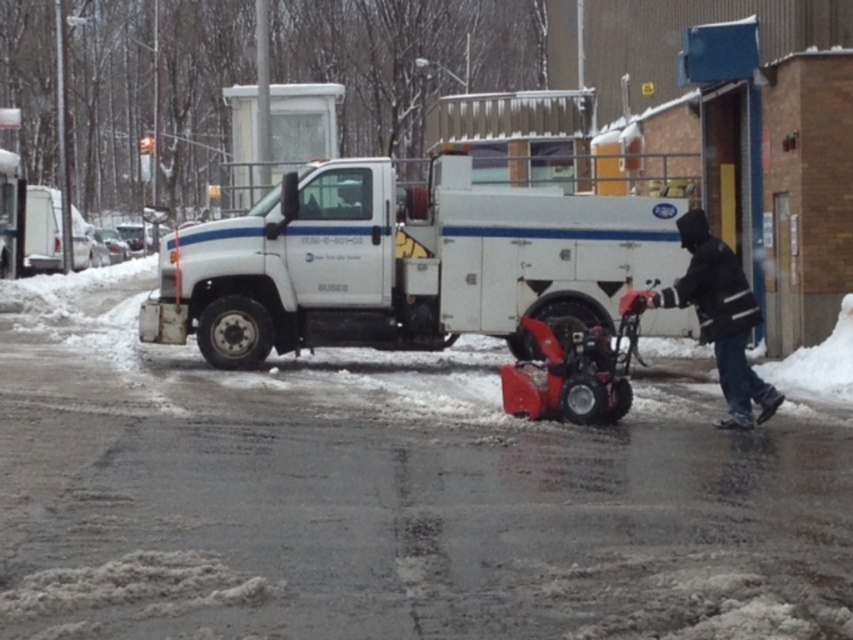
Question: Does white matte truck at center appear on the left side of black matte jacket at center?

Choices:
 (A) yes
 (B) no

Answer: (A)

Question: Which point is farther to the camera?

Choices:
 (A) white matte truck at center
 (B) black matte jacket at center

Answer: (A)

Question: Observing the image, what is the correct spatial positioning of white matte truck at center in reference to black matte jacket at center?

Choices:
 (A) above
 (B) below

Answer: (A)

Question: Does white matte truck at center have a larger size compared to black matte jacket at center?

Choices:
 (A) no
 (B) yes

Answer: (A)